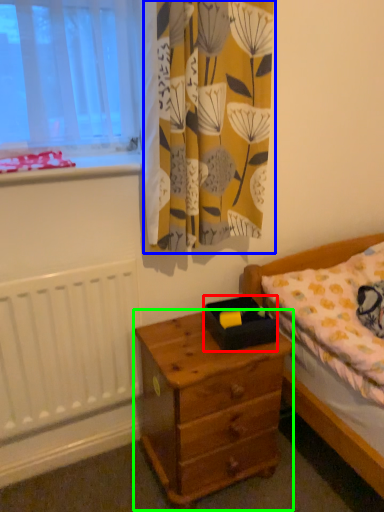
Question: Estimate the real-world distances between objects in this image. Which object is farther from box (highlighted by a red box), curtain (highlighted by a blue box) or nightstand (highlighted by a green box)?

Choices:
 (A) curtain
 (B) nightstand

Answer: (A)